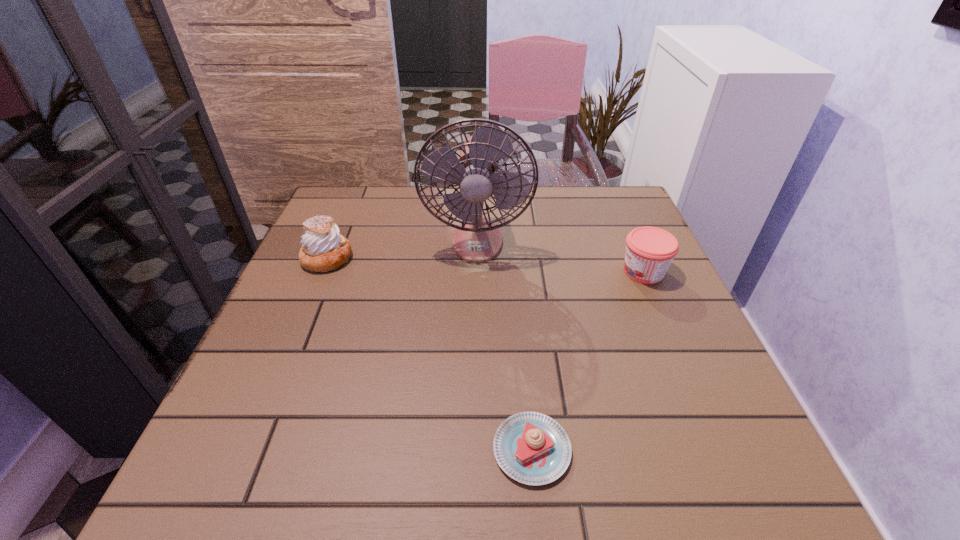
In order to click on fan in this screenshot , I will do `click(477, 239)`.

You are a GUI agent. You are given a task and a screenshot of the screen. Output one action in this format:
    pyautogui.click(x=<x>, y=<y>)
    Task: Click on the taller pastry
    Image resolution: width=960 pixels, height=540 pixels.
    Given the screenshot: What is the action you would take?
    pyautogui.click(x=324, y=249)

Where is `the leftmost object`? the leftmost object is located at coordinates (324, 249).

Where is `jam`? The height and width of the screenshot is (540, 960). jam is located at coordinates (650, 251).

Image resolution: width=960 pixels, height=540 pixels. In order to click on the rightmost object in this screenshot , I will do `click(650, 251)`.

Find the location of `the shorter pastry`. the shorter pastry is located at coordinates (532, 448).

Locate an element on the screen. This screenshot has width=960, height=540. the right pastry is located at coordinates (532, 448).

Where is `vacant space located 0.390m in front of the fan to direct airflow`? The image size is (960, 540). vacant space located 0.390m in front of the fan to direct airflow is located at coordinates (475, 419).

The height and width of the screenshot is (540, 960). I want to click on vacant space located on the right of the left pastry, so click(404, 258).

This screenshot has width=960, height=540. In order to click on free space located on the front label of the second shortest object in this screenshot , I will do `click(575, 272)`.